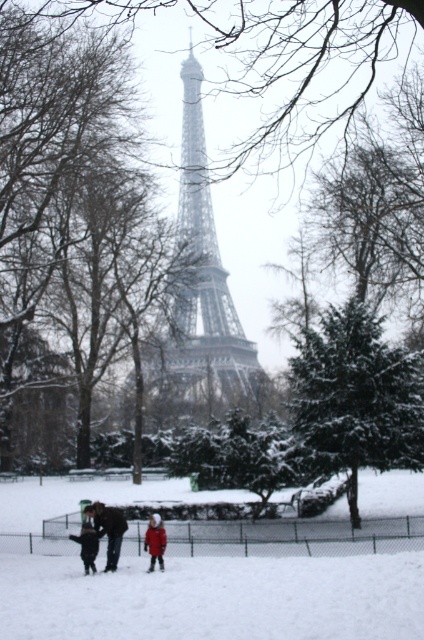
You are standing in the winter scene at the Eiffel Tower and notice two points marked in the image. Which point, point [201,397] or point [83,540], is closer to your viewpoint?

Point [201,397] is further to the camera than point [83,540], so the point closer to your viewpoint is point [83,540].

You are a photographer positioned at the Eiffel Tower during winter. You want to take a photo that includes both the red woolen coat at center and the dark gray coat at lower left. Which coat should you adjust your camera focus to ensure the subject closer to you is in sharp focus?

The red woolen coat at center is closer to you than the dark gray coat at lower left, so you should focus on the red woolen coat at center to ensure it is in sharp focus.

You are standing at the center of the Eiffel Tower area and want to locate the red woolen coat at center. According to the coordinates provided, where should you look relative to your current position?

The red woolen coat at center is located at coordinates point (155, 540). Since you are at the center, you should look towards the lower right direction to find it.